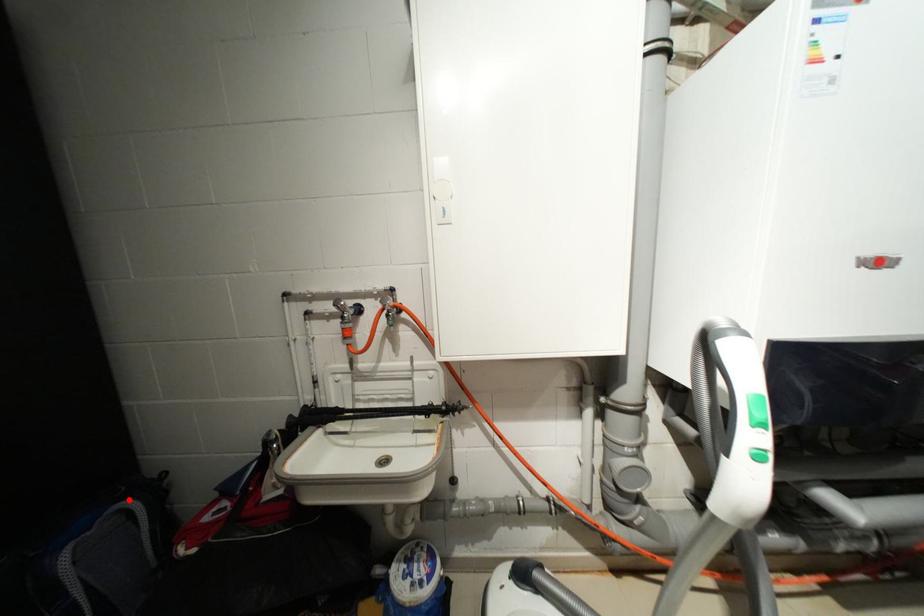
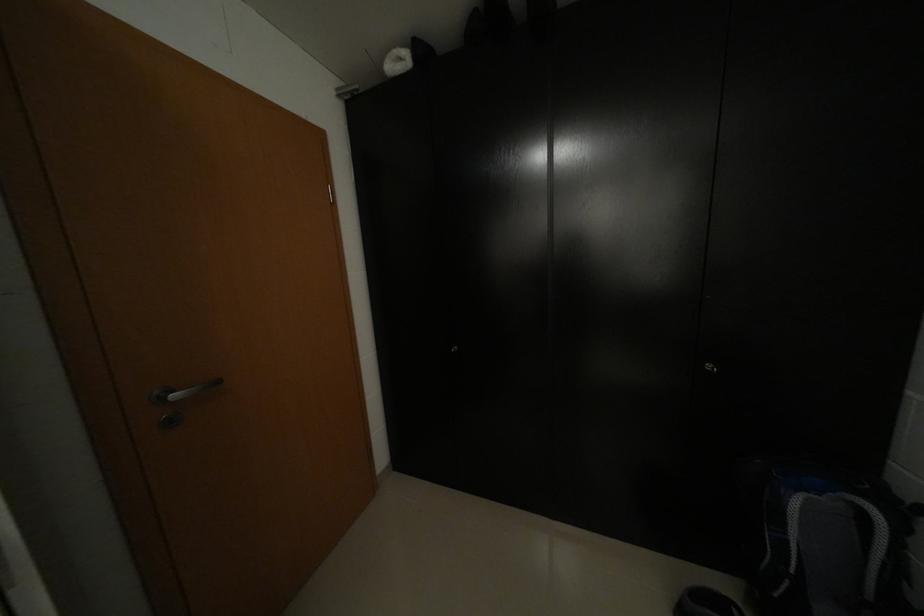
Find the pixel in the second image that matches the highlighted location in the first image.

(867, 495)